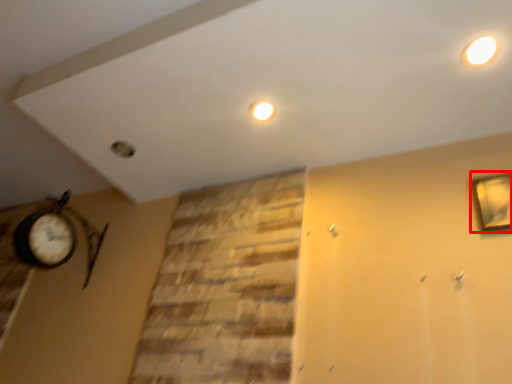
Question: From the image's perspective, what is the correct spatial relationship of picture frame (annotated by the red box) in relation to lighting?

Choices:
 (A) below
 (B) above

Answer: (A)